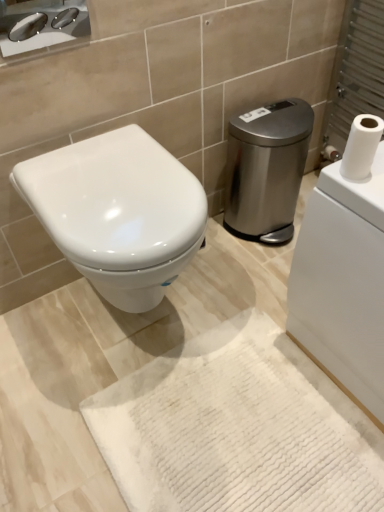
Where is `white glossy toilet at center`? white glossy toilet at center is located at coordinates click(118, 212).

Measure the distance between point (176,467) and camera.

Point (176,467) is 3.33 feet from camera.

What is the approximate width of white textured bath mat at center?

The width of white textured bath mat at center is 60.16 centimeters.

Image resolution: width=384 pixels, height=512 pixels. Describe the element at coordinates (42, 25) in the screenshot. I see `polished chrome sink at upper left` at that location.

The width and height of the screenshot is (384, 512). I want to click on white glossy toilet at center, so click(x=118, y=212).

Is white matte toilet paper at upper right positioned far away from polished chrome sink at upper left?

No, white matte toilet paper at upper right is not far away from polished chrome sink at upper left.

Which is more to the left, white matte toilet paper at upper right or polished chrome sink at upper left?

polished chrome sink at upper left.

Which of these two, white matte toilet paper at upper right or polished chrome sink at upper left, is thinner?

Thinner between the two is polished chrome sink at upper left.

From the image's perspective, who appears lower, white textured bath mat at center or polished chrome sink at upper left?

white textured bath mat at center appears lower in the image.

What's the angular difference between white textured bath mat at center and polished chrome sink at upper left's facing directions?

The angular difference between white textured bath mat at center and polished chrome sink at upper left is 90.9 degrees.

Looking at this image, is white textured bath mat at center taller or shorter than polished chrome sink at upper left?

In the image, white textured bath mat at center appears to be shorter than polished chrome sink at upper left.

Between white textured bath mat at center and polished chrome sink at upper left, which one appears on the right side from the viewer's perspective?

white textured bath mat at center.

Is the surface of white matte toilet paper at upper right in direct contact with satin silver trash can at center right?

No, white matte toilet paper at upper right is not touching satin silver trash can at center right.

Considering the sizes of objects white matte toilet paper at upper right and satin silver trash can at center right in the image provided, who is bigger, white matte toilet paper at upper right or satin silver trash can at center right?

satin silver trash can at center right is bigger.

Between white matte toilet paper at upper right and satin silver trash can at center right, which one has less height?

white matte toilet paper at upper right is shorter.

Between white matte toilet paper at upper right and satin silver trash can at center right, which one has smaller width?

With smaller width is white matte toilet paper at upper right.

Between polished chrome sink at upper left and satin silver trash can at center right, which one has smaller width?

With smaller width is polished chrome sink at upper left.

Which is behind, polished chrome sink at upper left or satin silver trash can at center right?

satin silver trash can at center right is more distant.

Based on the photo, could you tell me if polished chrome sink at upper left is turned towards satin silver trash can at center right?

No, polished chrome sink at upper left is not aimed at satin silver trash can at center right.

Considering the sizes of objects polished chrome sink at upper left and satin silver trash can at center right in the image provided, who is taller, polished chrome sink at upper left or satin silver trash can at center right?

Standing taller between the two is satin silver trash can at center right.

From the image's perspective, between white textured bath mat at center and satin silver trash can at center right, which one is located above?

satin silver trash can at center right appears higher in the image.

Is white textured bath mat at center spatially inside satin silver trash can at center right, or outside of it?

white textured bath mat at center is not enclosed by satin silver trash can at center right.

Can you confirm if white textured bath mat at center is shorter than satin silver trash can at center right?

Yes, white textured bath mat at center is shorter than satin silver trash can at center right.

Looking at their sizes, would you say polished chrome sink at upper left is wider or thinner than white textured bath mat at center?

Considering their sizes, polished chrome sink at upper left looks slimmer than white textured bath mat at center.

Which object is closer to the camera taking this photo, polished chrome sink at upper left or white textured bath mat at center?

white textured bath mat at center.

Is white textured bath mat at center located within polished chrome sink at upper left?

Actually, white textured bath mat at center is outside polished chrome sink at upper left.

Who is bigger, polished chrome sink at upper left or white textured bath mat at center?

white textured bath mat at center.

Between point (340, 170) and point (234, 362), which one is positioned in front?

The point (340, 170) is closer.

Consider the image. Measure the distance between white matte toilet paper at upper right and white textured bath mat at center.

white matte toilet paper at upper right is 26.98 inches from white textured bath mat at center.

From the image's perspective, between white matte toilet paper at upper right and white textured bath mat at center, who is located below?

white textured bath mat at center appears lower in the image.

Considering the sizes of objects white matte toilet paper at upper right and white textured bath mat at center in the image provided, who is thinner, white matte toilet paper at upper right or white textured bath mat at center?

white matte toilet paper at upper right.

Where is `toilet paper in front of the polished chrome sink at upper left`? toilet paper in front of the polished chrome sink at upper left is located at coordinates (361, 146).

Find the location of `sink on the left of white textured bath mat at center`. sink on the left of white textured bath mat at center is located at coordinates (42, 25).

Looking at the image, which one is located further to white textured bath mat at center, white matte toilet paper at upper right or polished chrome sink at upper left?

Based on the image, polished chrome sink at upper left appears to be further to white textured bath mat at center.

Which object lies nearer to the anchor point satin silver trash can at center right, white matte toilet paper at upper right or white glossy toilet at center?

white glossy toilet at center.

From the image, which object appears to be farther from white glossy toilet at center, polished chrome sink at upper left or white textured bath mat at center?

white textured bath mat at center is positioned further to the anchor white glossy toilet at center.

Estimate the real-world distances between objects in this image. Which object is further from satin silver trash can at center right, white matte toilet paper at upper right or polished chrome sink at upper left?

Based on the image, polished chrome sink at upper left appears to be further to satin silver trash can at center right.

Which object lies further to the anchor point white glossy toilet at center, satin silver trash can at center right or white textured bath mat at center?

satin silver trash can at center right.

Which object lies further to the anchor point polished chrome sink at upper left, white glossy toilet at center or white textured bath mat at center?

The object further to polished chrome sink at upper left is white textured bath mat at center.

Which object lies nearer to the anchor point satin silver trash can at center right, white matte toilet paper at upper right or white textured bath mat at center?

white matte toilet paper at upper right.

From the image, which object appears to be nearer to polished chrome sink at upper left, white glossy toilet at center or satin silver trash can at center right?

white glossy toilet at center.

The height and width of the screenshot is (512, 384). Identify the location of toilet that lies between polished chrome sink at upper left and white textured bath mat at center from top to bottom. (118, 212).

This screenshot has height=512, width=384. What are the coordinates of `toilet between white matte toilet paper at upper right and white textured bath mat at center from top to bottom` in the screenshot? It's located at (118, 212).

Locate an element on the screen. The width and height of the screenshot is (384, 512). toilet paper between satin silver trash can at center right and white textured bath mat at center from top to bottom is located at coordinates (361, 146).

Where is `toilet paper between polished chrome sink at upper left and white textured bath mat at center vertically`? Image resolution: width=384 pixels, height=512 pixels. toilet paper between polished chrome sink at upper left and white textured bath mat at center vertically is located at coordinates (361, 146).